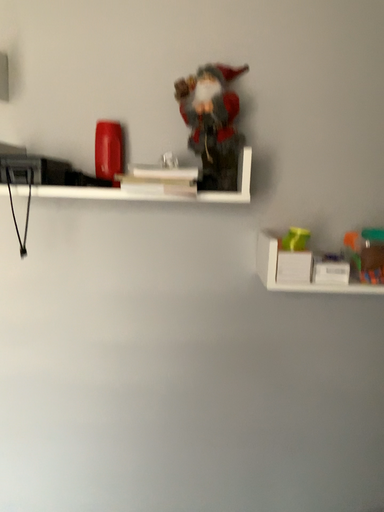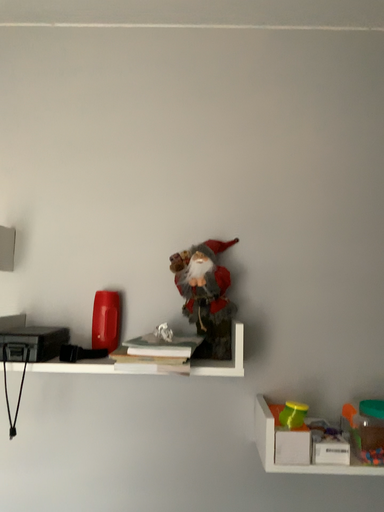
Question: How did the camera likely rotate when shooting the video?

Choices:
 (A) rotated upward
 (B) rotated downward

Answer: (A)